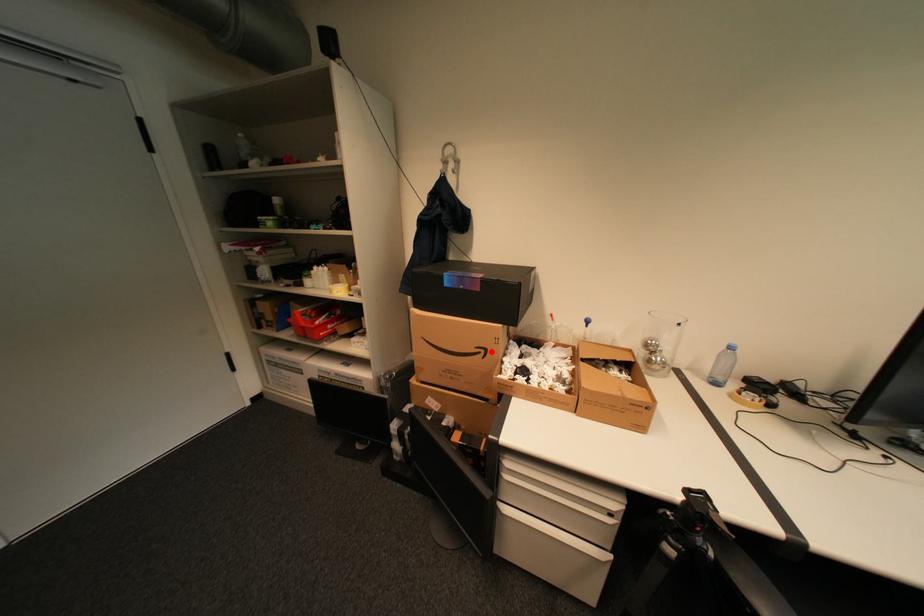
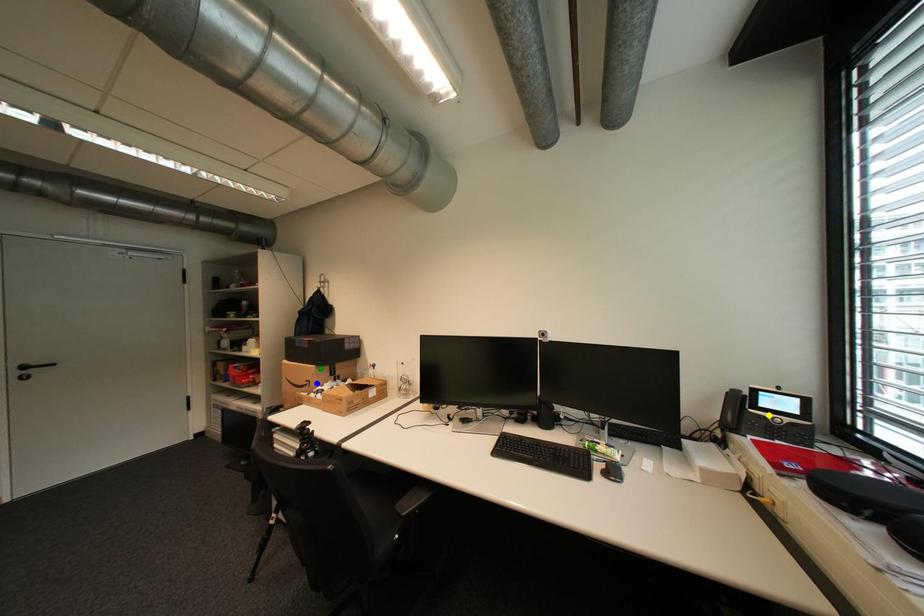
Question: I am providing you with two images of the same scene from different viewpoints. A red point is marked on the first image. You are given multiple points on the second image. Which point in image 2 is actually the same real-world point as the red point in image 1?

Choices:
 (A) green point
 (B) blue point
 (C) yellow point

Answer: (B)